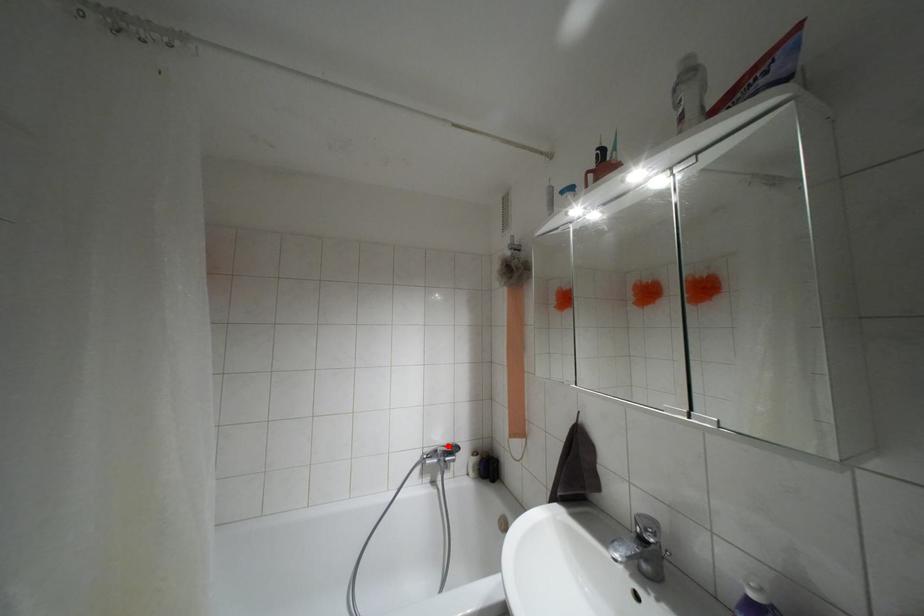
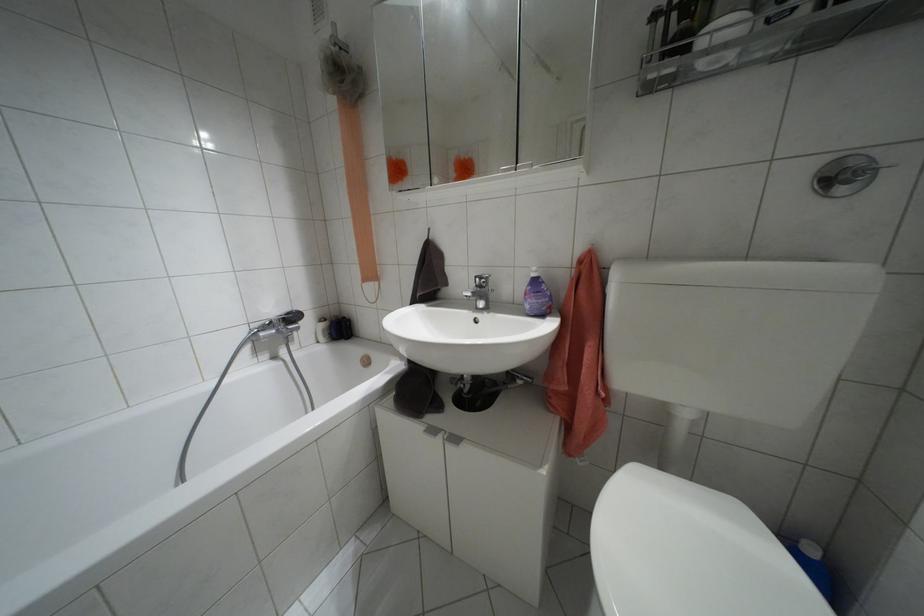
Locate, in the second image, the point that corresponds to the highlighted location in the first image.

(286, 313)